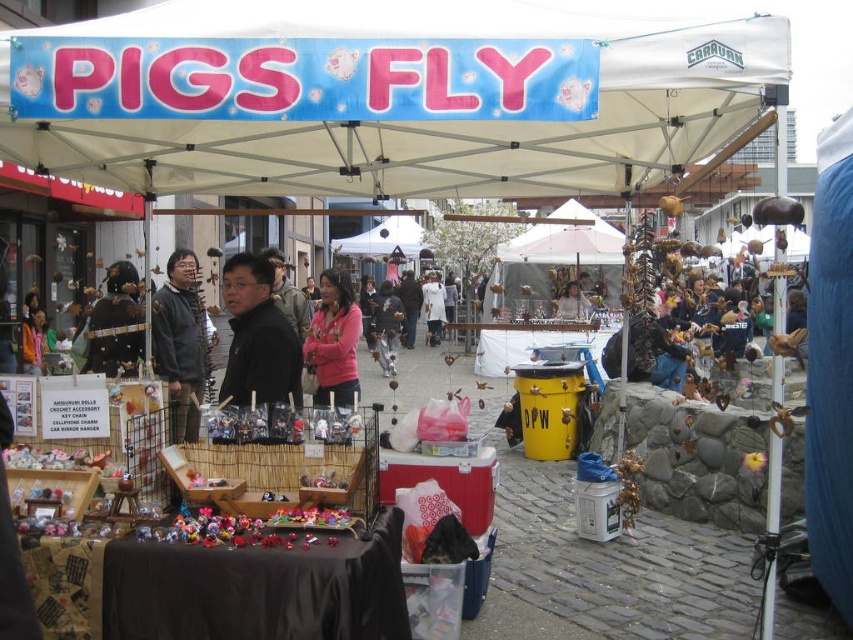
Question: Which point is closer to the camera taking this photo?

Choices:
 (A) (329, 390)
 (B) (287, 364)
 (C) (509, 310)
 (D) (419, 72)

Answer: (D)

Question: Which point is farther to the camera?

Choices:
 (A) black matte jacket at center
 (B) pink fleece jacket at center
 (C) blue fabric canopy at upper center
 (D) white fabric umbrella at center

Answer: (D)

Question: Can you confirm if blue fabric canopy at upper center is positioned to the left of pink fleece jacket at center?

Choices:
 (A) no
 (B) yes

Answer: (A)

Question: Can you confirm if blue fabric canopy at upper center is positioned to the right of white fabric umbrella at center?

Choices:
 (A) no
 (B) yes

Answer: (A)

Question: Does blue fabric canopy at upper center appear over pink fleece jacket at center?

Choices:
 (A) no
 (B) yes

Answer: (B)

Question: Which point is farther from the camera taking this photo?

Choices:
 (A) (218, 22)
 (B) (254, 401)
 (C) (554, 332)
 (D) (341, 392)

Answer: (C)